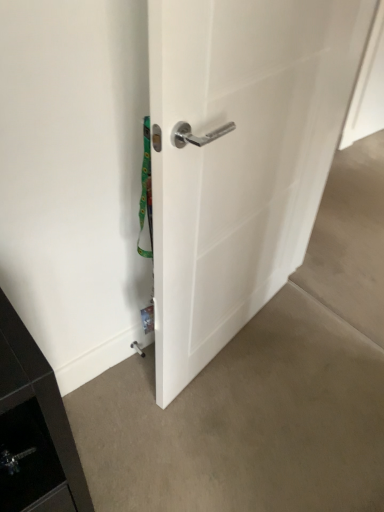
Locate an element on the screen. vacant space to the right of white glossy door handle at center is located at coordinates (305, 344).